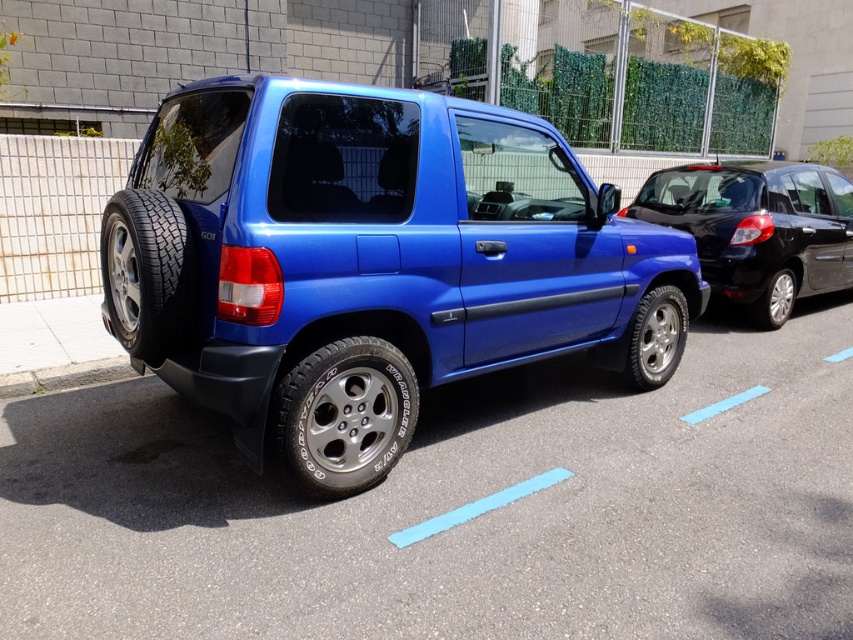
Image resolution: width=853 pixels, height=640 pixels. What are the coordinates of `metallic blue suv at center` in the screenshot? It's located at (363, 260).

Where is `metallic blue suv at center`? This screenshot has height=640, width=853. metallic blue suv at center is located at coordinates (363, 260).

Who is positioned more to the left, glossy black sedan at right or black rubber tire at left?

Positioned to the left is black rubber tire at left.

Who is positioned more to the right, glossy black sedan at right or black rubber tire at left?

glossy black sedan at right

Image resolution: width=853 pixels, height=640 pixels. I want to click on glossy black sedan at right, so click(758, 228).

Is point (154, 244) closer to camera compared to point (680, 304)?

Yes, point (154, 244) is in front of point (680, 304).

Between point (169, 205) and point (646, 360), which one is positioned in front?

Positioned in front is point (169, 205).

Which is in front, point (186, 240) or point (659, 371)?

Point (186, 240)

The height and width of the screenshot is (640, 853). I want to click on black rubber tire at left, so click(x=146, y=273).